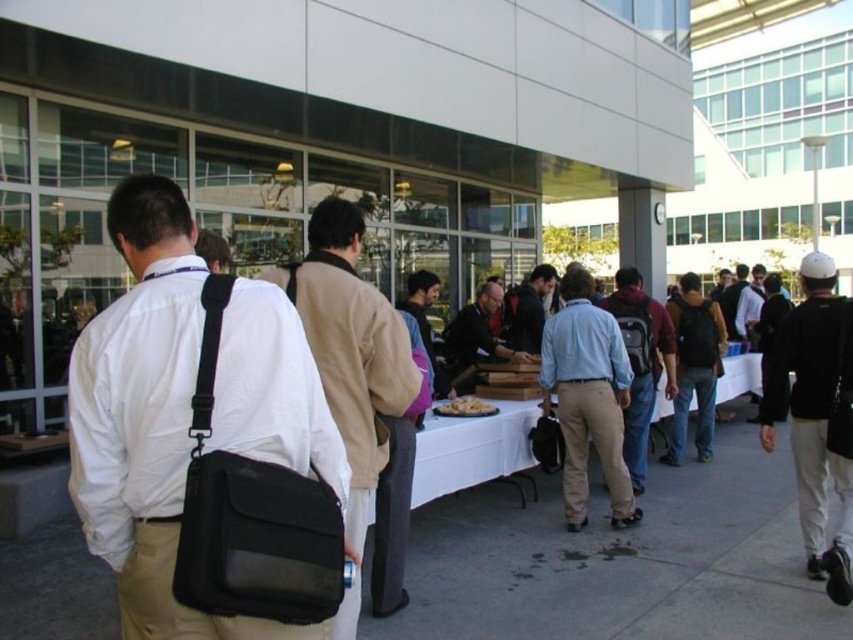
Locate an element on the screen. The width and height of the screenshot is (853, 640). black fabric bag at center is located at coordinates (131, 413).

How much distance is there between black fabric bag at center and golden crispy fries at center?

black fabric bag at center and golden crispy fries at center are 11.79 feet apart.

Describe the element at coordinates (131, 413) in the screenshot. I see `black fabric bag at center` at that location.

The height and width of the screenshot is (640, 853). I want to click on black fabric bag at center, so click(131, 413).

Between light blue cotton shirt at center and white cloth table at center, which one is positioned lower?

white cloth table at center

Locate an element on the screen. This screenshot has height=640, width=853. light blue cotton shirt at center is located at coordinates (587, 397).

Who is positioned more to the left, light blue cotton shirt at center or dark blue backpack at center?

light blue cotton shirt at center is more to the left.

Can you confirm if light blue cotton shirt at center is thinner than dark blue backpack at center?

Indeed, light blue cotton shirt at center has a lesser width compared to dark blue backpack at center.

Who is more forward, (573, 417) or (705, 413)?

Positioned in front is point (573, 417).

This screenshot has width=853, height=640. I want to click on light blue cotton shirt at center, so click(587, 397).